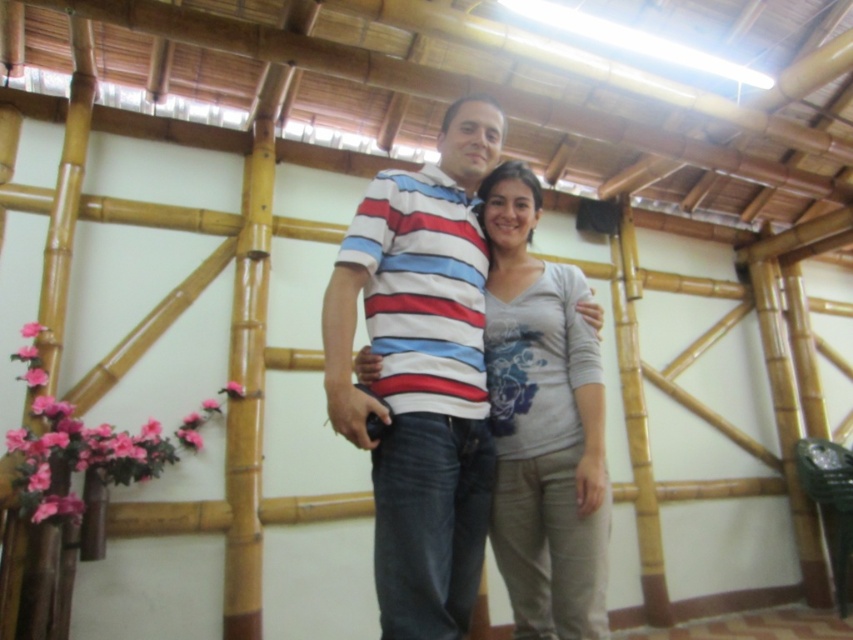
Is striped cotton shirt at center below gray cotton shirt at center?

No.

Which of these two, striped cotton shirt at center or gray cotton shirt at center, stands taller?

Standing taller between the two is striped cotton shirt at center.

Image resolution: width=853 pixels, height=640 pixels. Describe the element at coordinates (421, 372) in the screenshot. I see `striped cotton shirt at center` at that location.

Find the location of a particular element. The image size is (853, 640). striped cotton shirt at center is located at coordinates (421, 372).